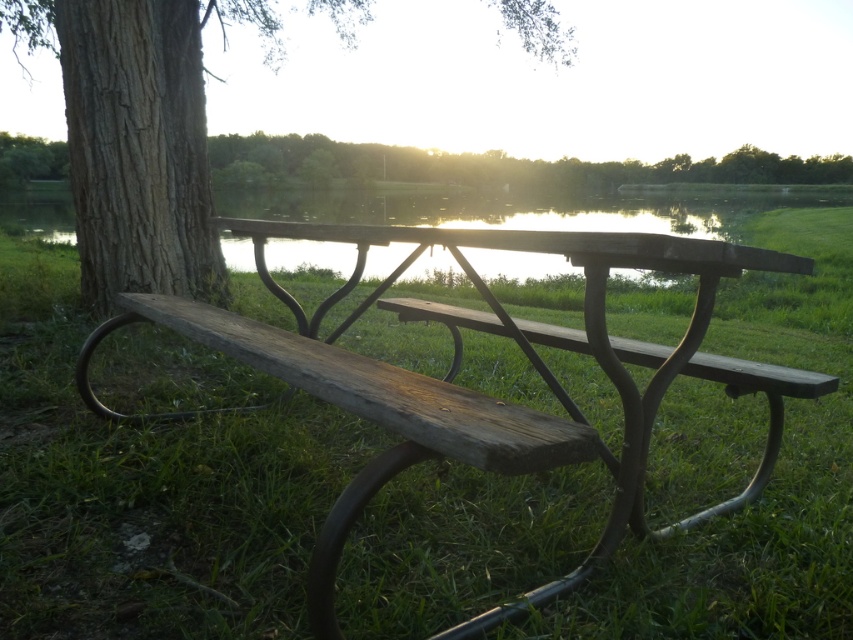
You are standing at the center of the picnic table and want to find the brown rough bark tree at left. In which direction should you look to see it?

The brown rough bark tree at left is located at point coordinates of 0.209 on the x axis and 0.163 on the y axis. Since you are at the center of the picnic table, you should look towards the left direction to find the tree.

You are planning to sit at the weathered wood bench at center to enjoy the view. However, you notice a brown rough bark tree at left nearby. Based on their positions, which object is closer to the ground?

The weathered wood bench at center is located below brown rough bark tree at left, meaning it is closer to the ground.